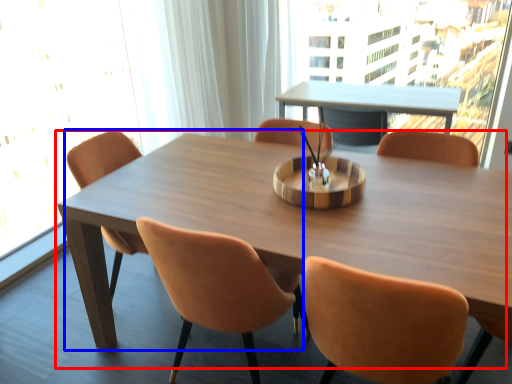
Question: Which object appears closest to the camera in this image, table (highlighted by a red box) or chair (highlighted by a blue box)?

Choices:
 (A) table
 (B) chair

Answer: (A)